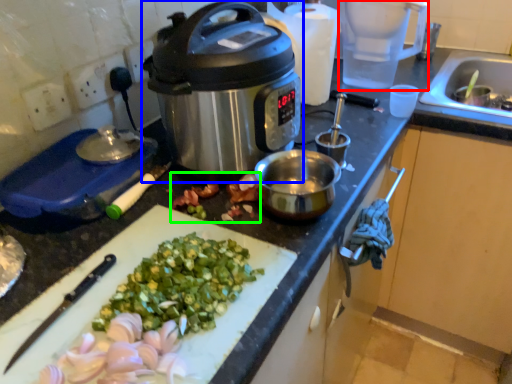
Question: Considering the real-world distances, which object is farthest from blender (highlighted by a red box)? slow cooker (highlighted by a blue box) or produce (highlighted by a green box)?

Choices:
 (A) slow cooker
 (B) produce

Answer: (B)